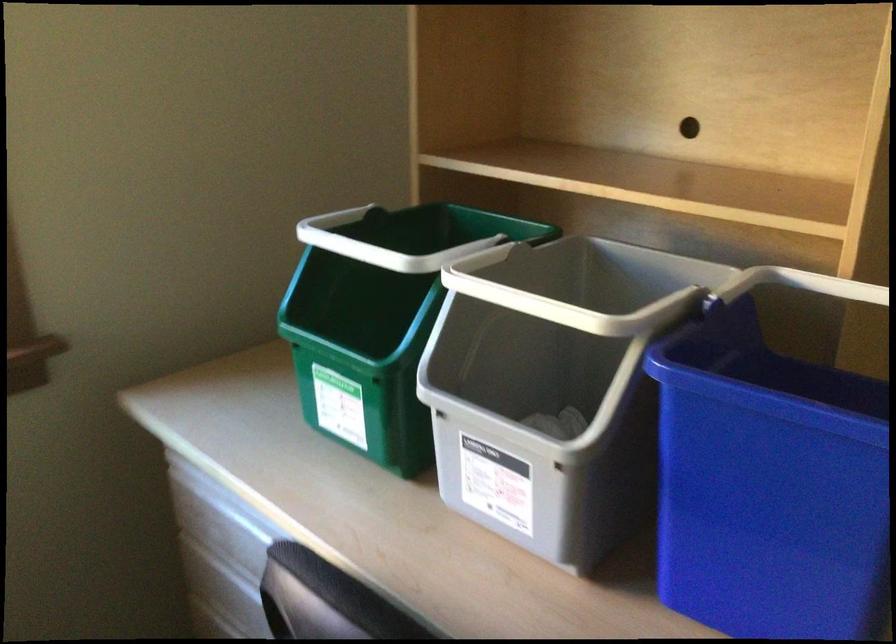
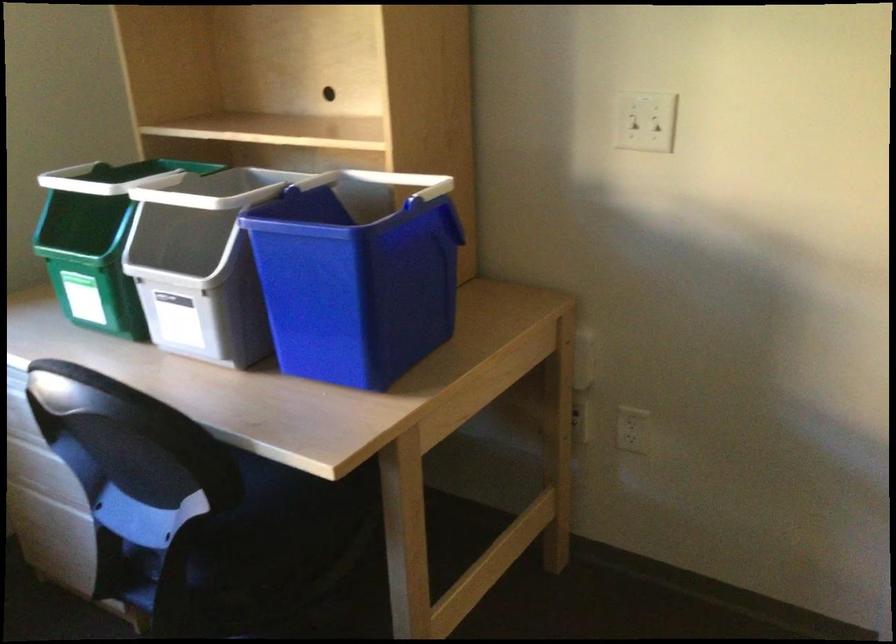
The point at (580, 263) is marked in the first image. Where is the corresponding point in the second image?

(245, 185)